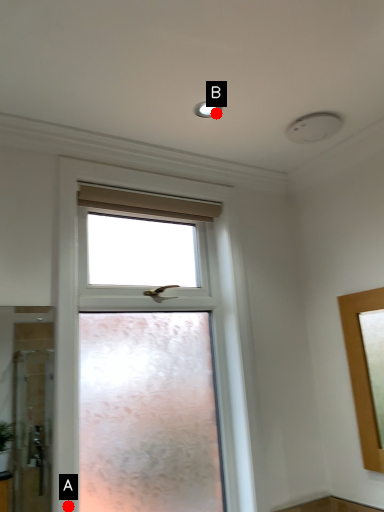
Question: Two points are circled on the image, labeled by A and B beside each circle. Which of the following is the farthest from the observer?

Choices:
 (A) A is further
 (B) B is further

Answer: (B)